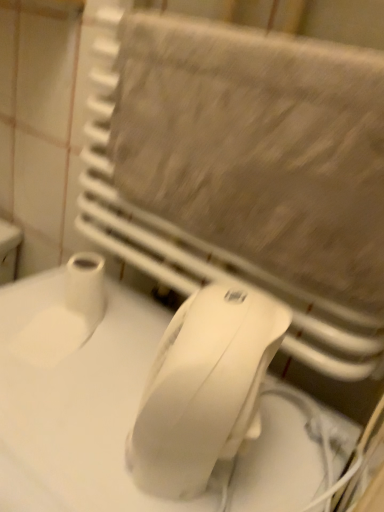
Question: Is beige textured towel at upper center bigger or smaller than white plastic mouse at center?

Choices:
 (A) big
 (B) small

Answer: (B)

Question: Based on their positions, is beige textured towel at upper center located to the left or right of white plastic mouse at center?

Choices:
 (A) right
 (B) left

Answer: (A)

Question: Which is nearer to the white matte toilet paper at lower left?

Choices:
 (A) white plastic mouse at center
 (B) white matte countertop at lower left
 (C) beige textured towel at upper center

Answer: (B)

Question: Which of these objects is positioned farthest from the white plastic mouse at center?

Choices:
 (A) white matte countertop at lower left
 (B) white matte toilet paper at lower left
 (C) beige textured towel at upper center

Answer: (B)